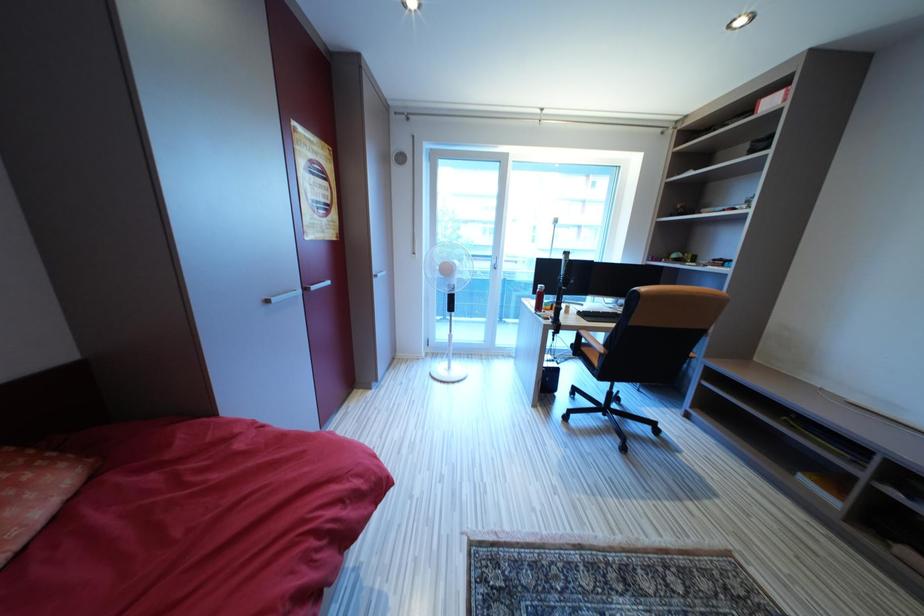
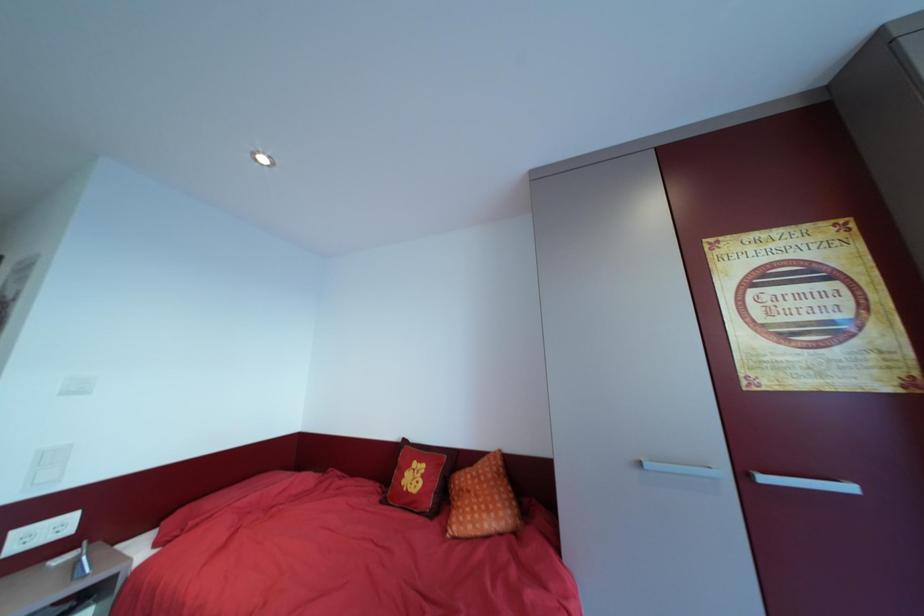
Question: Based on the continuous images, in which direction is the camera rotating? Reply with the corresponding letter.

Choices:
 (A) Left
 (B) Right
 (C) Up
 (D) Down

Answer: (A)